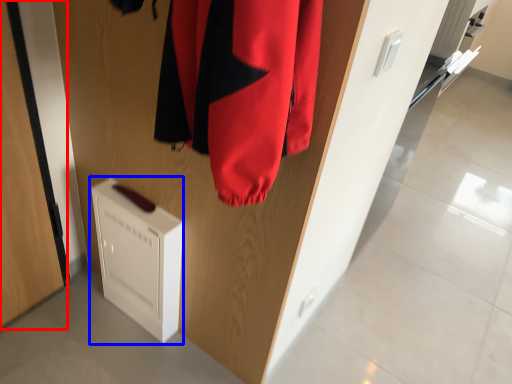
Question: Which object appears closest to the camera in this image, door (highlighted by a red box) or appliance (highlighted by a blue box)?

Choices:
 (A) door
 (B) appliance

Answer: (A)